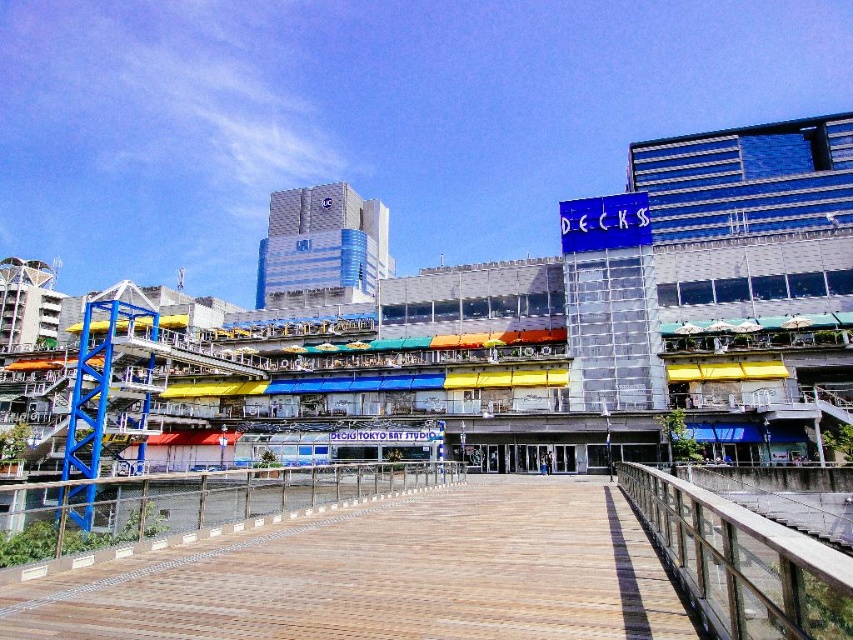
Question: Which object is the farthest from the wooden deck at center?

Choices:
 (A) wooden at center
 (B) blue glass building at center
 (C) metallic silver railing at center

Answer: (B)

Question: Observing the image, what is the correct spatial positioning of blue glass building at center in reference to wooden deck at center?

Choices:
 (A) above
 (B) below

Answer: (A)

Question: Where is wooden at center located in relation to metallic silver railing at center in the image?

Choices:
 (A) right
 (B) left

Answer: (A)

Question: Considering the relative positions of blue glass building at center and wooden at center in the image provided, where is blue glass building at center located with respect to wooden at center?

Choices:
 (A) above
 (B) below

Answer: (A)

Question: Among these points, which one is farthest from the camera?

Choices:
 (A) (412, 604)
 (B) (456, 472)

Answer: (B)

Question: Which object is farther from the camera taking this photo?

Choices:
 (A) wooden at center
 (B) wooden deck at center
 (C) blue glass building at center

Answer: (C)